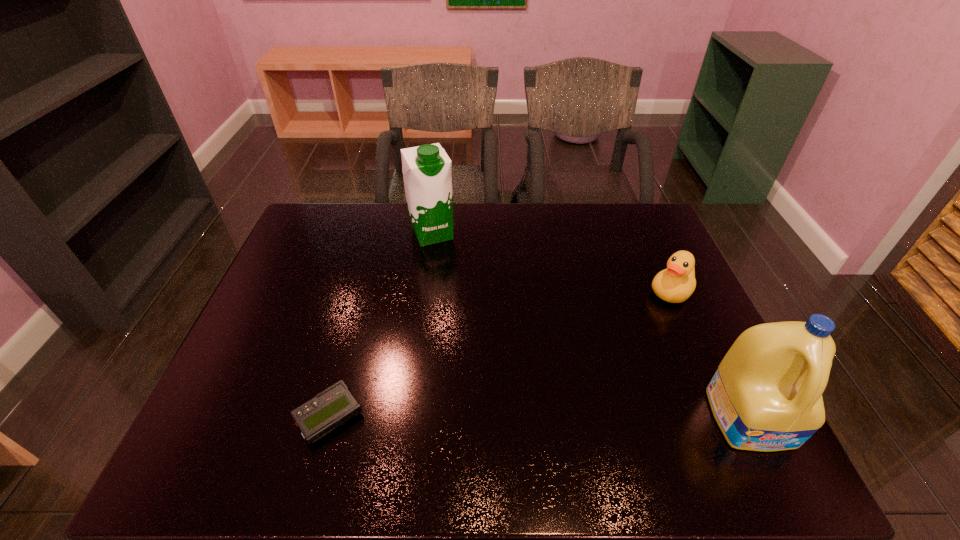
At what (x,y) coordinates should I click in order to perform the action: click on vacant region at the far edge. Please return your answer as a coordinate pair (x, y). This screenshot has height=540, width=960. Looking at the image, I should click on (543, 234).

Where is `free region at the near edge of the desktop`? The height and width of the screenshot is (540, 960). free region at the near edge of the desktop is located at coordinates (307, 393).

Locate an element on the screen. Image resolution: width=960 pixels, height=540 pixels. free space at the left edge of the desktop is located at coordinates pyautogui.click(x=251, y=355).

Locate an element on the screen. vacant space at the right edge of the desktop is located at coordinates (651, 289).

In order to click on vacant space at the far left corner of the desktop in this screenshot , I will do `click(325, 230)`.

The width and height of the screenshot is (960, 540). In the image, there is a desktop. Identify the location of vacant space at the near left corner. (282, 392).

Locate an element on the screen. vacant space at the far right corner of the desktop is located at coordinates (633, 218).

The image size is (960, 540). Identify the location of free space between the soya milk and the third nearest object. (552, 262).

The width and height of the screenshot is (960, 540). I want to click on vacant area that lies between the leftmost object and the detergent, so click(540, 417).

This screenshot has width=960, height=540. I want to click on empty location between the duck and the shortest object, so click(500, 354).